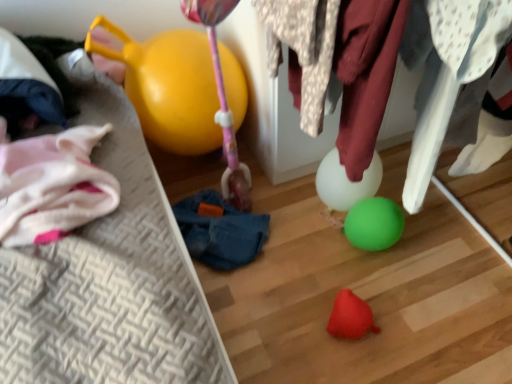
This screenshot has height=384, width=512. I want to click on vacant area that is in front of rubber red toy at lower center, so click(x=362, y=364).